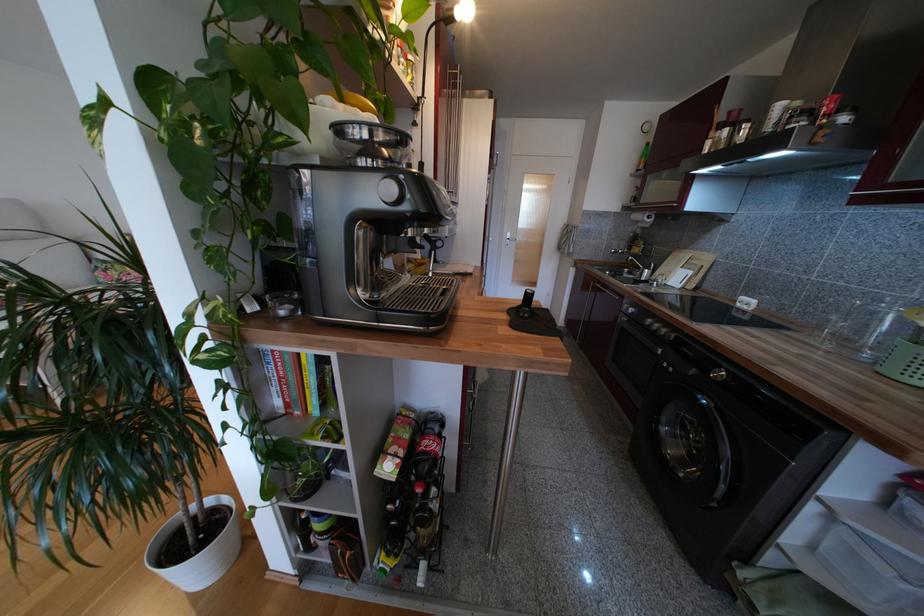
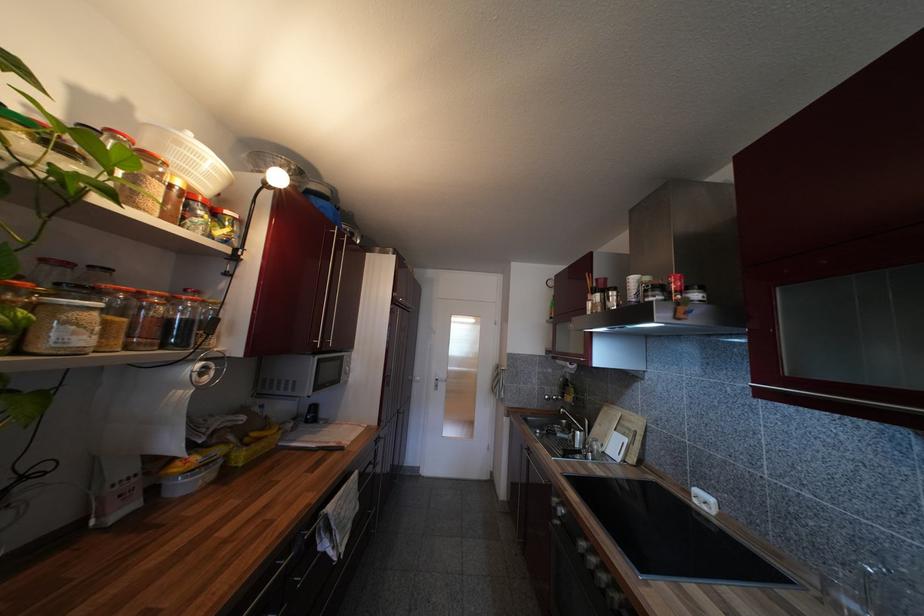
The point at (628, 310) is marked in the first image. Where is the corresponding point in the second image?

(557, 507)